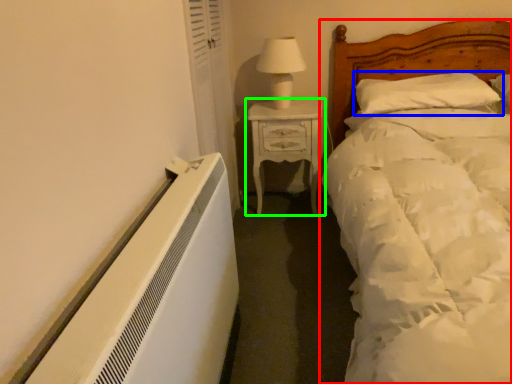
Question: Which object is positioned farthest from bed (highlighted by a red box)? Select from pillow (highlighted by a blue box) and nightstand (highlighted by a green box).

Choices:
 (A) pillow
 (B) nightstand

Answer: (B)